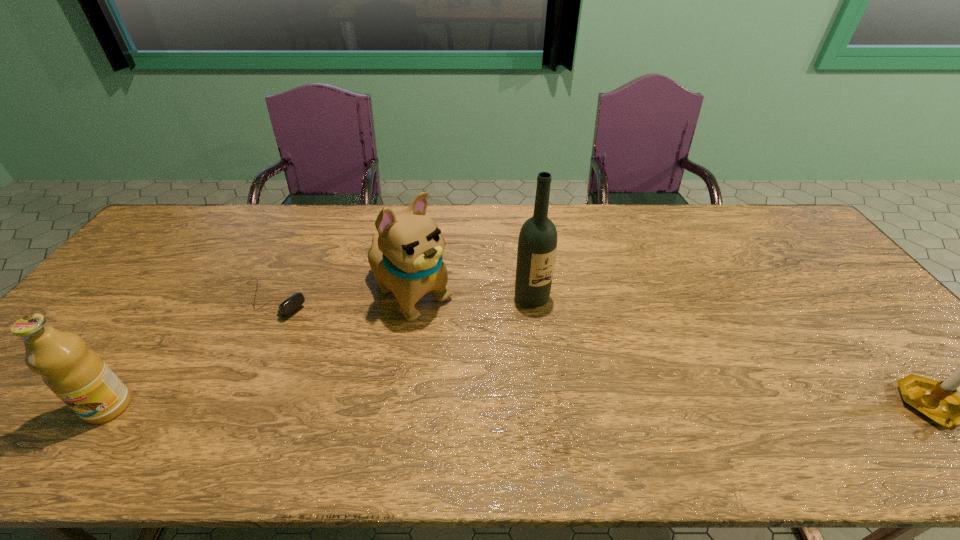
In order to click on olive oil in this screenshot , I will do `click(78, 376)`.

Identify the location of the leftmost object. The image size is (960, 540). (78, 376).

Locate an element on the screen. The width and height of the screenshot is (960, 540). wine bottle is located at coordinates (537, 244).

Identify the location of webcam. (294, 301).

Locate an element on the screen. This screenshot has width=960, height=540. the second object from left to right is located at coordinates (294, 301).

Where is `the second tallest object`? the second tallest object is located at coordinates (406, 257).

Where is `puppy`? The image size is (960, 540). puppy is located at coordinates (406, 257).

You are a GUI agent. You are given a task and a screenshot of the screen. Output one action in this format:
    pyautogui.click(x=<x>, y=<y>)
    Task: Click on the vacant point located 0.160m on the labeled side of the wine bottle
    
    Given the screenshot: What is the action you would take?
    pyautogui.click(x=571, y=352)

I want to click on free space located on the labeled side of the wine bottle, so click(x=555, y=330).

Find the location of `vacant space located on the labeled side of the wine bottle`. vacant space located on the labeled side of the wine bottle is located at coordinates (557, 333).